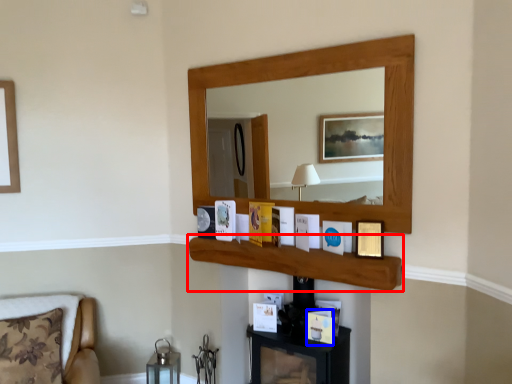
Question: Which point is closer to the camera, cabinet (highlighted by a red box) or picture frame (highlighted by a blue box)?

Choices:
 (A) cabinet
 (B) picture frame

Answer: (A)